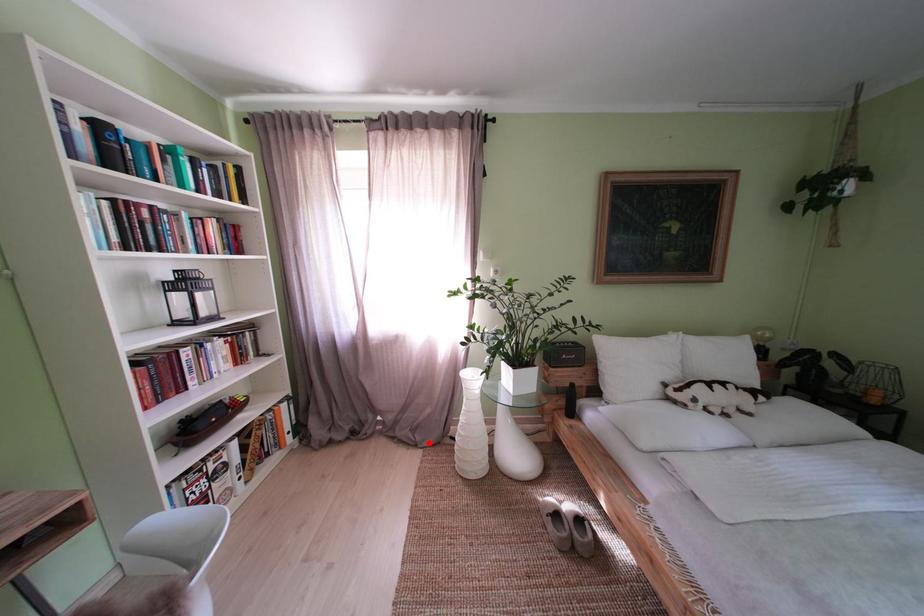
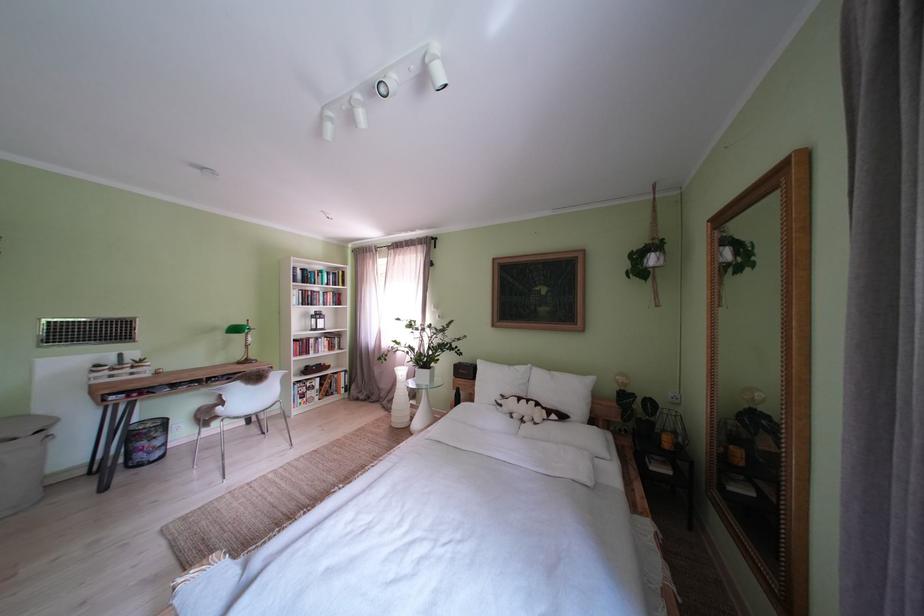
Question: A red point is marked in image1. In image2, is the corresponding 3D point closer to the camera or farther? Reply with the corresponding letter.

Choices:
 (A) The corresponding 3D point is closer.
 (B) The corresponding 3D point is farther.

Answer: (B)